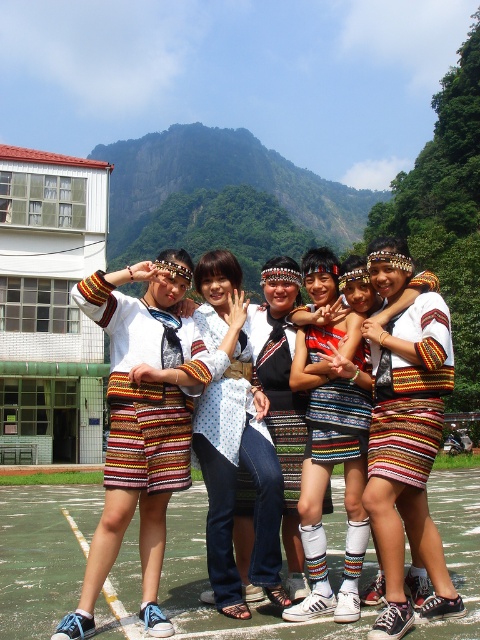
You are a photographer trying to capture the perfect shot of the group. You notice the white dotted shirt at center and the knitted multicolored skirt at center. Which one should you focus on if you want to highlight the lower part of the outfit?

The white dotted shirt at center is below the knitted multicolored skirt at center, so focusing on the white dotted shirt at center would highlight the lower part of the outfit.

From the picture: You are a photographer trying to capture a photo of the group. You notice the white dotted shirt at center and the knitted multicolored skirt at center. Which one is positioned to the left of the other?

The white dotted shirt at center is to the left of the knitted multicolored skirt at center.